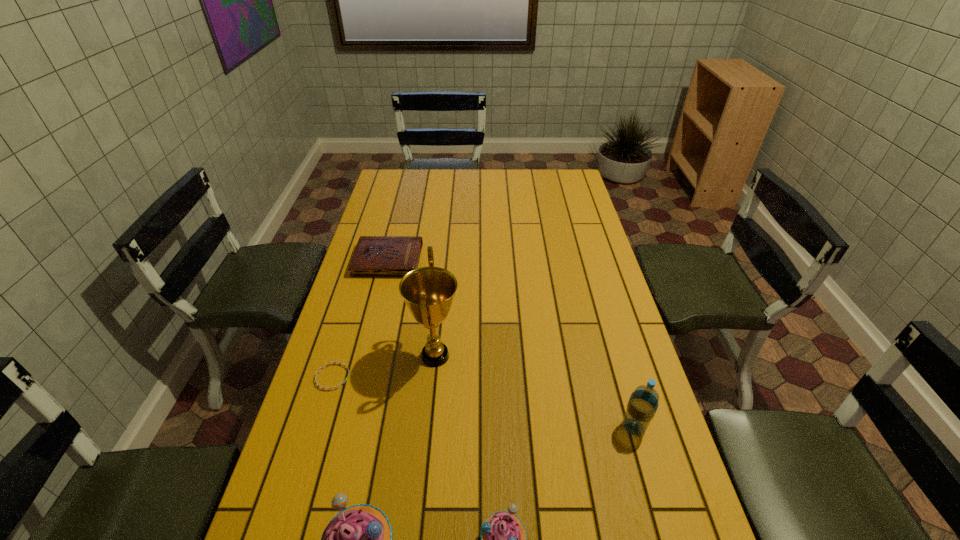
Please show where to add a muffin on the right while keeping spacing even. Please provide its 2D coordinates. Your answer should be formatted as a tuple, i.e. [(x, y)], where the tuple contains the x and y coordinates of a point satisfying the conditions above.

[(639, 534)]